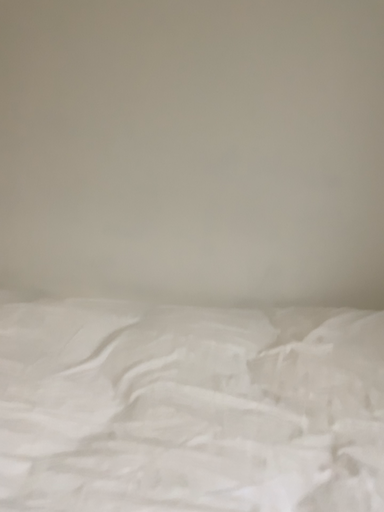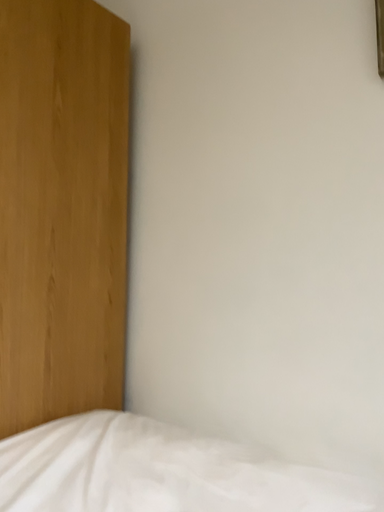
Question: Which way did the camera rotate in the video?

Choices:
 (A) rotated right
 (B) rotated left

Answer: (B)